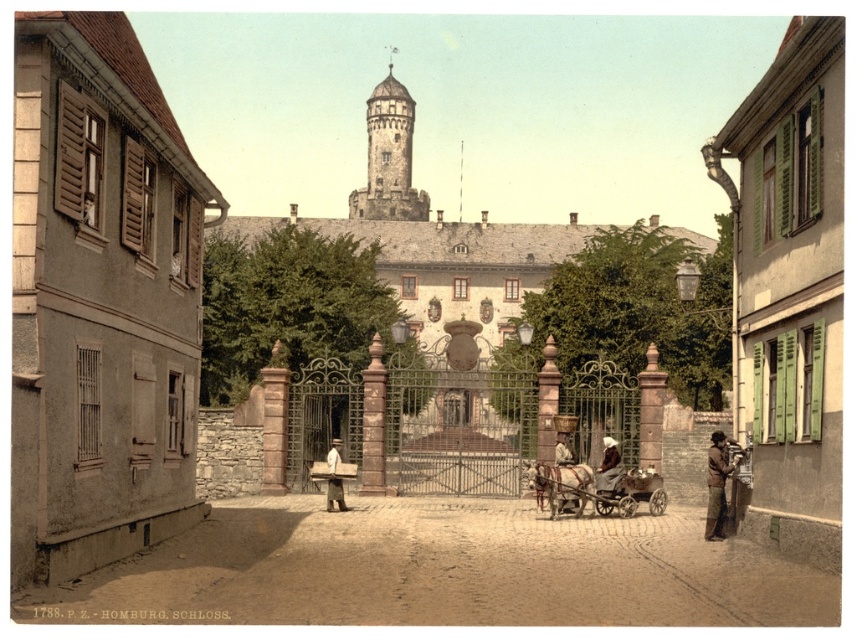
In the scene shown: Is brown stone tower at center positioned before brown leather hat at center?

No, it is behind brown leather hat at center.

Which is above, brown stone tower at center or brown leather hat at center?

brown stone tower at center is above.

What do you see at coordinates (388, 156) in the screenshot? The image size is (857, 640). I see `brown stone tower at center` at bounding box center [388, 156].

This screenshot has height=640, width=857. In order to click on brown stone tower at center in this screenshot , I will do `click(388, 156)`.

Who is positioned more to the left, brown cobblestone alley at center or brown leather coat at center?

brown leather coat at center

Is brown cobblestone alley at center to the right of brown leather coat at center from the viewer's perspective?

Indeed, brown cobblestone alley at center is positioned on the right side of brown leather coat at center.

Find the location of `brown cobblestone alley at center`. brown cobblestone alley at center is located at coordinates (442, 572).

Between point (363, 186) and point (607, 444), which one is positioned behind?

Point (363, 186)

Is brown stone tower at center smaller than light brown fur coat at center?

Incorrect, brown stone tower at center is not smaller in size than light brown fur coat at center.

This screenshot has width=857, height=640. What do you see at coordinates (388, 156) in the screenshot? I see `brown stone tower at center` at bounding box center [388, 156].

This screenshot has height=640, width=857. I want to click on brown stone tower at center, so click(388, 156).